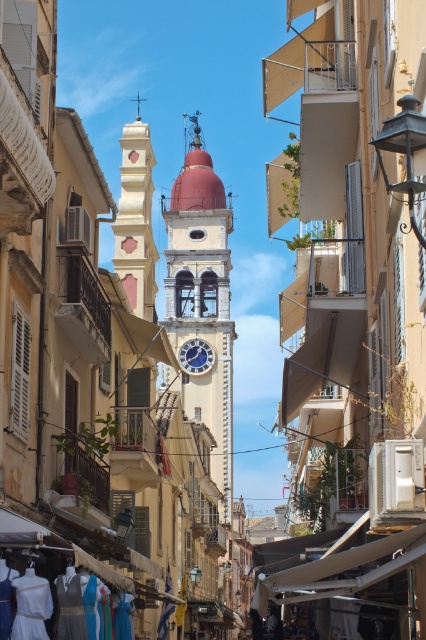
Can you confirm if white stone clock tower at center is positioned above white cotton dresses at lower left?

Indeed, white stone clock tower at center is positioned over white cotton dresses at lower left.

Where is `white stone clock tower at center`? Image resolution: width=426 pixels, height=640 pixels. white stone clock tower at center is located at coordinates (201, 296).

Where is `white stone clock tower at center`? white stone clock tower at center is located at coordinates (201, 296).

Find the location of a particular element. The height and width of the screenshot is (640, 426). white stone clock tower at center is located at coordinates (201, 296).

Locate an element on the screen. smooth white church at center is located at coordinates (356, 323).

The image size is (426, 640). What are the coordinates of `white stone clock tower at center` in the screenshot? It's located at (201, 296).

Who is more distant from viewer, (216, 362) or (207, 349)?

Positioned behind is point (207, 349).

Where is `white stone clock tower at center`? This screenshot has height=640, width=426. white stone clock tower at center is located at coordinates (201, 296).